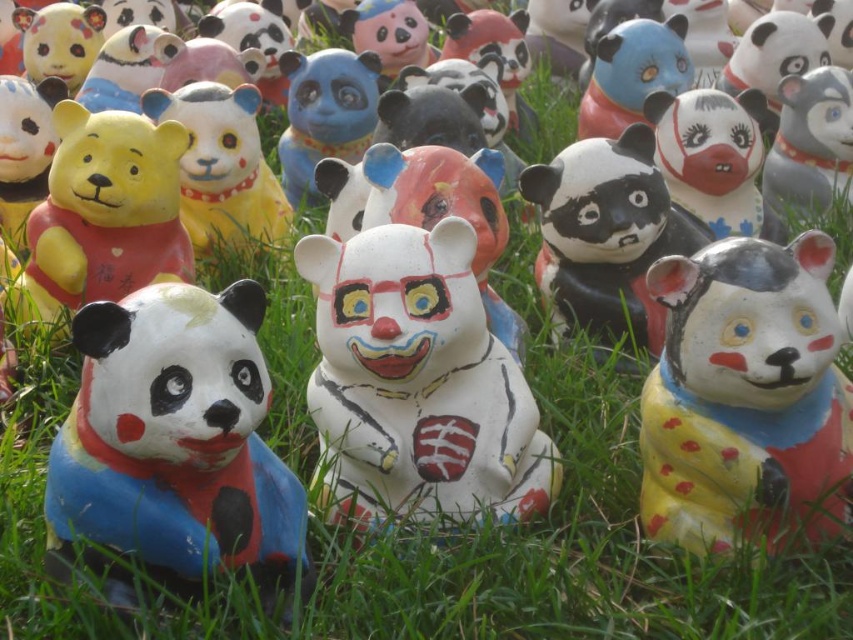
You are an art curator arranging these figurines for an exhibition. You need to ensure that the white glossy panda at center is positioned to the right of the yellow matte bear at center. Is the current arrangement correct based on the image?

Yes, the current arrangement is correct because the white glossy panda at center is indeed to the right of the yellow matte bear at center as described in the image.

You are a visitor at an outdoor art exhibition and see the matte painted panda at lower left and the white matte clown bear at center. Which figurine is positioned lower in the arrangement?

The matte painted panda at lower left is positioned lower than the white matte clown bear at center.

You are standing in front of the figurines and want to know how far you are from the point marked at coordinates (421, 445). Can you determine the distance?

The point at coordinates (421, 445) is 1.74 meters away from the camera, so you are 1.74 meters away from that point.